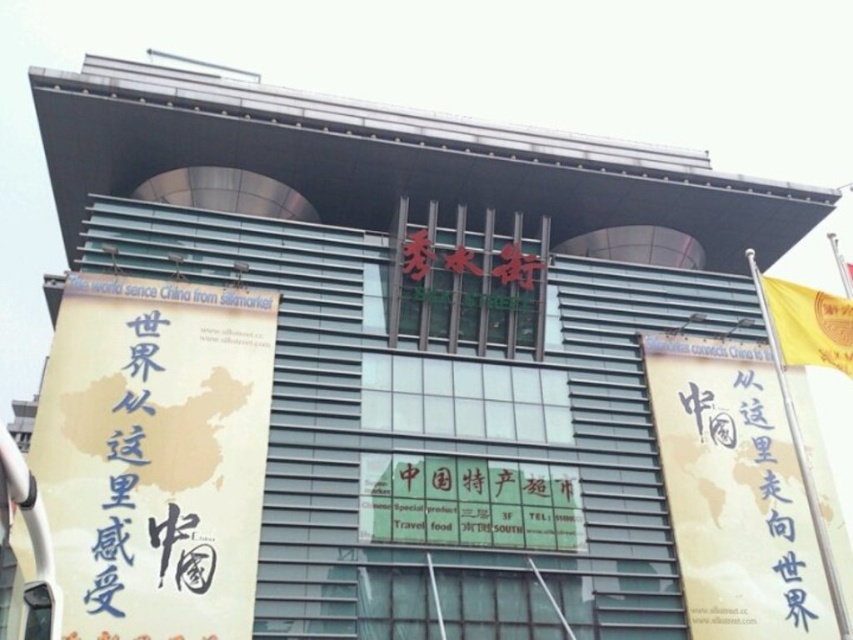
Who is shorter, yellow paper sign at left or yellow paper banner at right?

yellow paper banner at right

Locate an element on the screen. The image size is (853, 640). yellow paper sign at left is located at coordinates (155, 456).

At what (x,y) coordinates should I click in order to perform the action: click on yellow paper sign at left. Please return your answer as a coordinate pair (x, y). Looking at the image, I should click on (155, 456).

Which is above, yellow paper banner at right or green matte signboard at center?

green matte signboard at center is higher up.

Is yellow paper banner at right bigger than green matte signboard at center?

Incorrect, yellow paper banner at right is not larger than green matte signboard at center.

Is point (695, 460) behind point (461, 464)?

Yes, it is behind point (461, 464).

The image size is (853, 640). I want to click on yellow paper banner at right, so click(734, 492).

Does point (492, 534) come in front of point (815, 314)?

No, it is not.

Can you confirm if green matte signboard at center is taller than yellow silk flag at upper right?

Yes, green matte signboard at center is taller than yellow silk flag at upper right.

Does point (432, 509) come in front of point (837, 358)?

No, it is not.

Identify the location of green matte signboard at center. This screenshot has height=640, width=853. (469, 502).